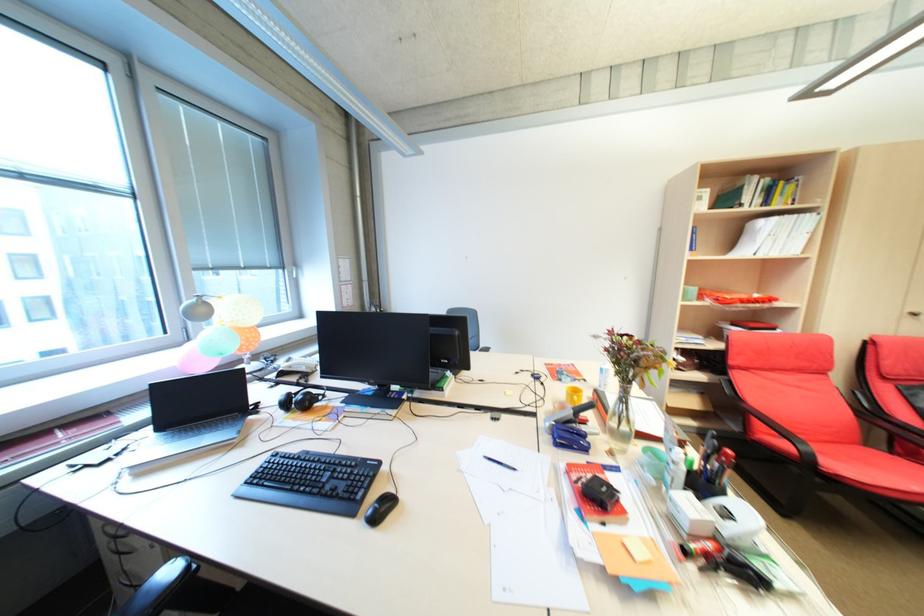
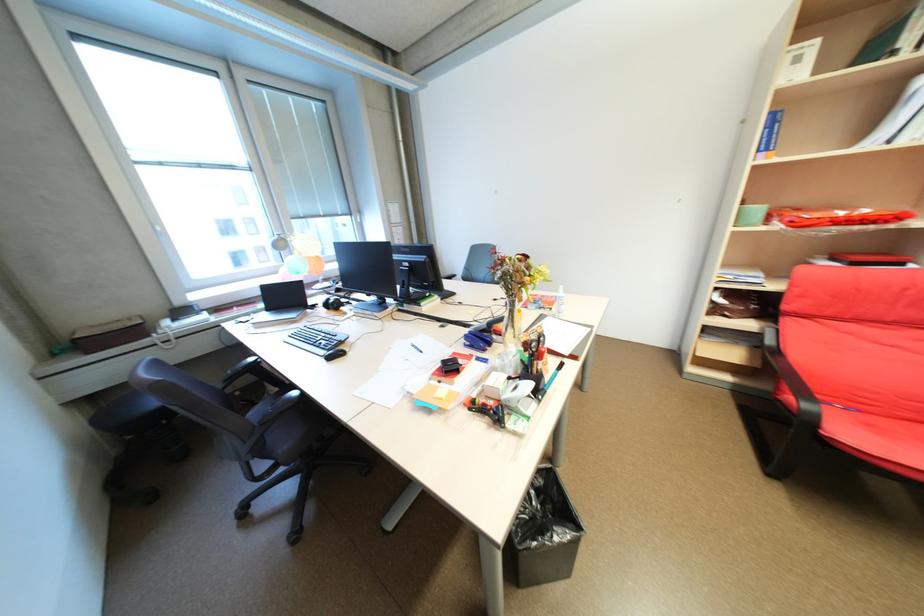
Question: The images are taken continuously from a first-person perspective. In which direction are you moving?

Choices:
 (A) Left
 (B) Right
 (C) Forward
 (D) Backward

Answer: (B)